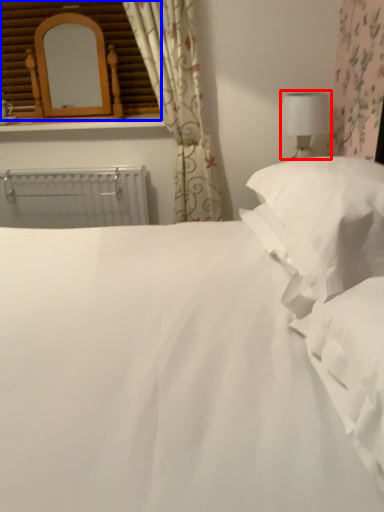
Question: Which object appears farthest to the camera in this image, table lamp (highlighted by a red box) or window frame (highlighted by a blue box)?

Choices:
 (A) table lamp
 (B) window frame

Answer: (B)